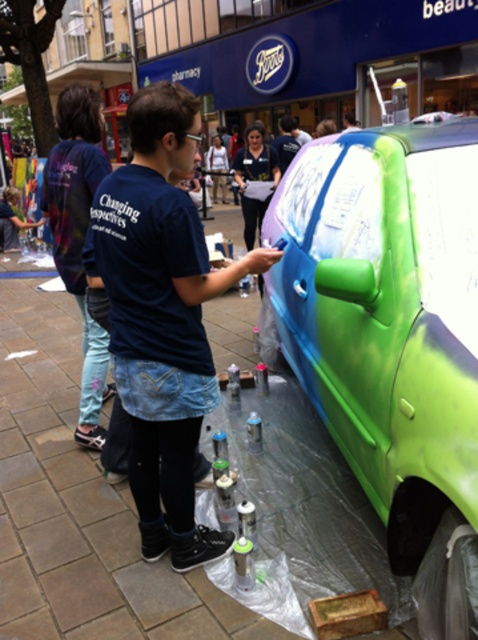
Is denim jacket at left to the right of denim jacket at center from the viewer's perspective?

In fact, denim jacket at left is to the left of denim jacket at center.

Which is behind, point (91, 198) or point (276, 152)?

The point (276, 152) is more distant.

The height and width of the screenshot is (640, 478). I want to click on denim jacket at left, so [78, 236].

Based on the photo, who is positioned more to the right, matte blue t-shirt at center or denim jacket at left?

matte blue t-shirt at center

Between matte blue t-shirt at center and denim jacket at left, which one is positioned higher?

denim jacket at left is above.

Find the location of `matte blue t-shirt at center`. matte blue t-shirt at center is located at coordinates (162, 317).

You are a GUI agent. You are given a task and a screenshot of the screen. Output one action in this format:
    pyautogui.click(x=<x>, y=<y>)
    Task: Click on the matte blue t-shirt at center
    
    Given the screenshot: What is the action you would take?
    pyautogui.click(x=162, y=317)

Between point (243, 273) and point (279, 164), which one is positioned behind?

Positioned behind is point (279, 164).

Between matte blue t-shirt at center and denim jacket at center, which one has less height?

denim jacket at center is shorter.

Is point (181, 556) positioned before point (279, 128)?

Yes, it is in front of point (279, 128).

Find the location of a particular element. This screenshot has width=478, height=640. matte blue t-shirt at center is located at coordinates (162, 317).